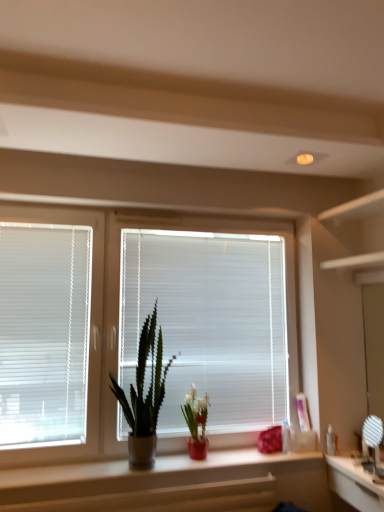
Question: Should I look upward or downward to see clear plastic bottle at right, arranged as the second toiletry when viewed from the left?

Choices:
 (A) down
 (B) up

Answer: (A)

Question: Is white plastic blinds at left, the second window blind when ordered from right to left, not close to green matte cactus at center, the first houseplant viewed from the left?

Choices:
 (A) yes
 (B) no

Answer: (B)

Question: Is white plastic blinds at left, which is counted as the 1th window blind, starting from the left, bigger than green matte cactus at center, the 2th houseplant when ordered from right to left?

Choices:
 (A) no
 (B) yes

Answer: (A)

Question: Can you confirm if white plastic blinds at left, the second window blind when ordered from right to left, is wider than green matte cactus at center, the first houseplant viewed from the left?

Choices:
 (A) no
 (B) yes

Answer: (A)

Question: Is white plastic blinds at left, which is counted as the 1th window blind, starting from the left, positioned with its back to green matte cactus at center, the first houseplant viewed from the left?

Choices:
 (A) no
 (B) yes

Answer: (A)

Question: Is white plastic blinds at left, which is counted as the 1th window blind, starting from the left, directly adjacent to green matte cactus at center, the first houseplant viewed from the left?

Choices:
 (A) no
 (B) yes

Answer: (A)

Question: Can you confirm if white plastic blinds at left, the second window blind when ordered from right to left, is thinner than green matte cactus at center, the first houseplant viewed from the left?

Choices:
 (A) yes
 (B) no

Answer: (A)

Question: From a real-world perspective, does white glossy mirror at lower right stand above clear plastic bottle at right, the first toiletry positioned from the right?

Choices:
 (A) yes
 (B) no

Answer: (B)

Question: Is clear plastic bottle at right, the first toiletry positioned from the right, located within white glossy mirror at lower right?

Choices:
 (A) yes
 (B) no

Answer: (B)

Question: Is white glossy mirror at lower right not close to clear plastic bottle at right, the first toiletry positioned from the right?

Choices:
 (A) no
 (B) yes

Answer: (A)

Question: Is white glossy mirror at lower right at the left side of clear plastic bottle at right, arranged as the second toiletry when viewed from the left?

Choices:
 (A) no
 (B) yes

Answer: (A)

Question: Does white glossy mirror at lower right have a smaller size compared to clear plastic bottle at right, the first toiletry positioned from the right?

Choices:
 (A) no
 (B) yes

Answer: (A)

Question: Does white glossy mirror at lower right have a greater width compared to clear plastic bottle at right, arranged as the second toiletry when viewed from the left?

Choices:
 (A) yes
 (B) no

Answer: (A)

Question: From a real-world perspective, is white plastic blinds at left, the second window blind when ordered from right to left, physically above white glossy mirror at lower right?

Choices:
 (A) no
 (B) yes

Answer: (B)